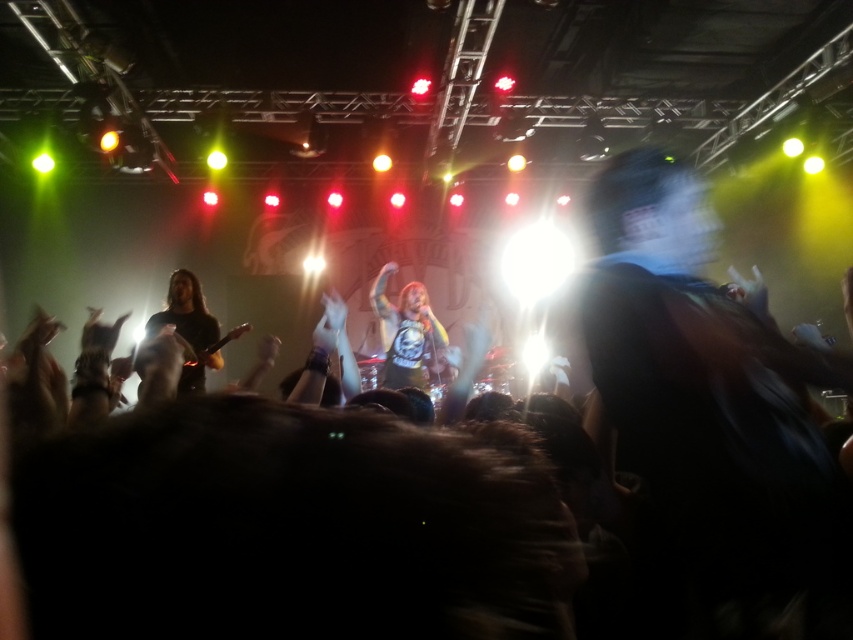
You are a photographer trying to capture the shiny silver guitar at center during the concert. The stage is illuminated by red and yellow lights. If you want to ensure the guitar is well lit, should you position yourself closer to the red or yellow lights? Explain your reasoning based on the guitar location and the lighting setup.

The shiny silver guitar at center is located at point (408, 333). Since the stage lights are predominantly red and yellow, positioning yourself closer to either color would affect the guitar lighting. However, silver reflects all colors, so both red and yellow lights would illuminate it effectively. Choose whichever light source is closer to your desired shooting position.

You are a photographer at the concert and want to capture a closeup of the shiny silver guitar at center without the black matte guitar at left blocking the view. Is this possible given their positions?

The shiny silver guitar at center is further to the viewer than the black matte guitar at left, so it would block the view of the shiny silver guitar at center. Therefore, capturing a closeup without the black matte guitar at left blocking is not possible.

You are a photographer at the concert and want to capture a photo of the shiny silver guitar at center and the black matte guitar at left. Which guitar is closer to the camera?

The shiny silver guitar at center is positioned under the black matte guitar at left, meaning the black matte guitar at left is closer to the camera.